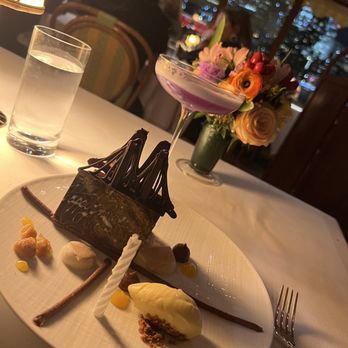
Where is `water glass`? This screenshot has height=348, width=348. water glass is located at coordinates (39, 101).